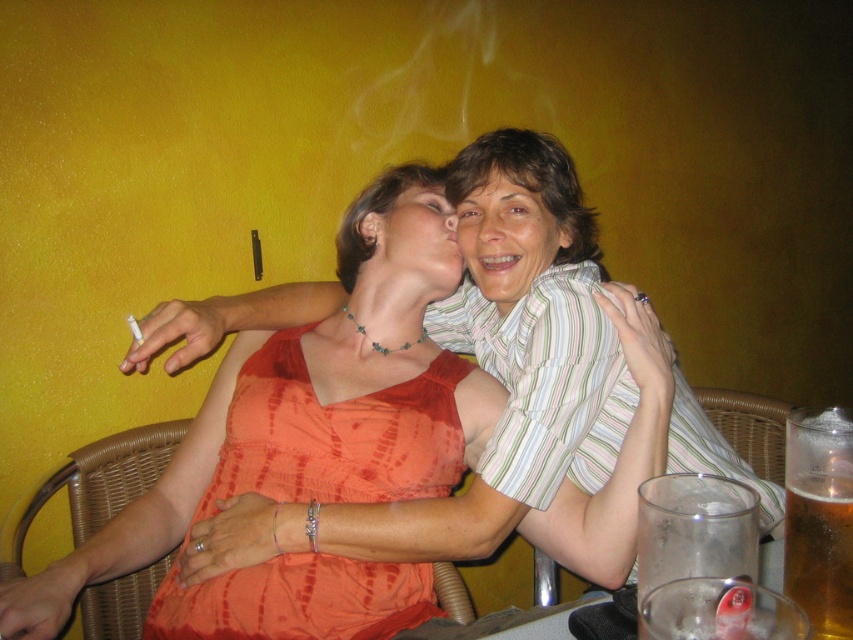
You are an artist trying to sketch this scene. You need to place the matte striped shirt at upper center and the matte white face at center in your drawing. Based on the description, which object should be drawn to the right of the other?

The matte striped shirt at upper center should be drawn to the right of the matte white face at center because the description states that the matte striped shirt at upper center is positioned on the right side of matte white face at center.

You are a bartender preparing drinks for two guests. You have a translucent glass beer at lower right and a matte white face at center. Which object is smaller in size?

The translucent glass beer at lower right is smaller than the matte white face at center according to the description.